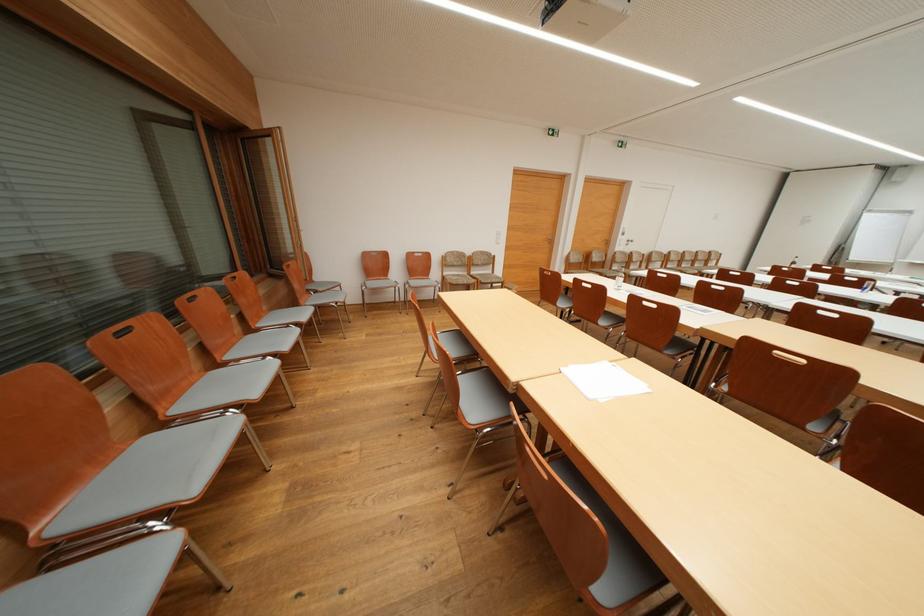
Find the location of a particular element. wooden door handle is located at coordinates (625, 240).